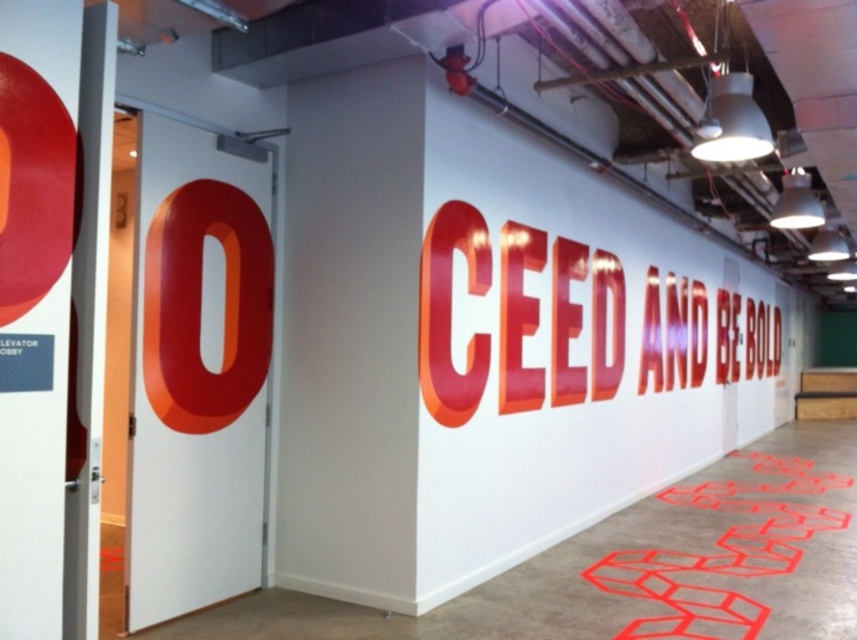
Can you confirm if shiny metallic letters at center is thinner than red glossy hexagons at lower right?

No, shiny metallic letters at center is not thinner than red glossy hexagons at lower right.

Does shiny metallic letters at center have a greater width compared to red glossy hexagons at lower right?

Correct, the width of shiny metallic letters at center exceeds that of red glossy hexagons at lower right.

Which is in front, point (470, 355) or point (628, 552)?

Point (470, 355)

You are a GUI agent. You are given a task and a screenshot of the screen. Output one action in this format:
    pyautogui.click(x=<x>, y=<y>)
    Task: Click on the shiny metallic letters at center
    The image size is (857, 640).
    Given the screenshot: What is the action you would take?
    pyautogui.click(x=451, y=312)